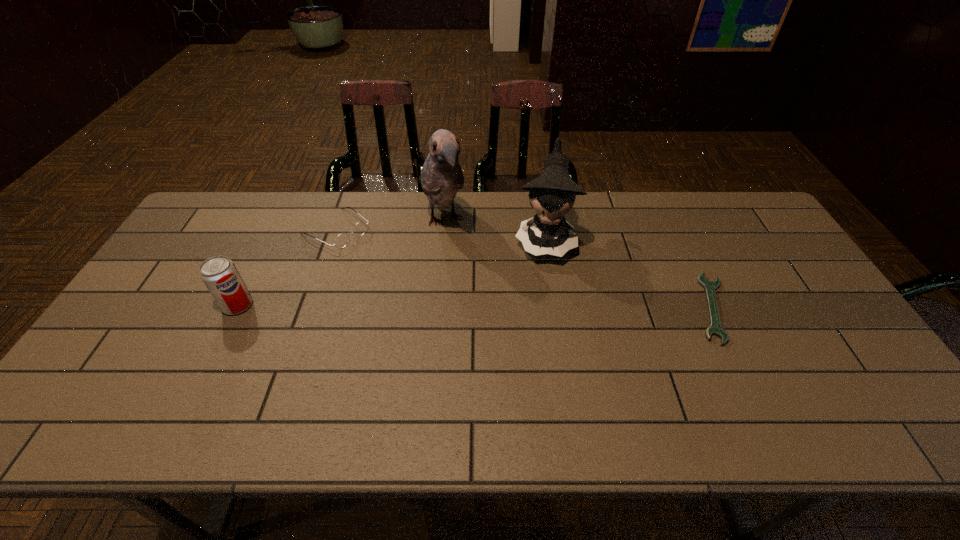
Locate which object ranks third in proximity to the leftmost object. Please provide its 2D coordinates. Your answer should be formatted as a tuple, i.e. [(x, y)], where the tuple contains the x and y coordinates of a point satisfying the conditions above.

[(553, 193)]

Where is `object that can be found as the third closest to the second object from right to left`? The image size is (960, 540). object that can be found as the third closest to the second object from right to left is located at coordinates (342, 239).

Locate an element on the screen. The image size is (960, 540). vacant space that satisfies the following two spatial constraints: 1. on the front side of the wrench; 2. on the right side of the second tallest object is located at coordinates (555, 308).

I want to click on free region that satisfies the following two spatial constraints: 1. on the back side of the leftmost object; 2. on the right side of the tallest object, so click(280, 221).